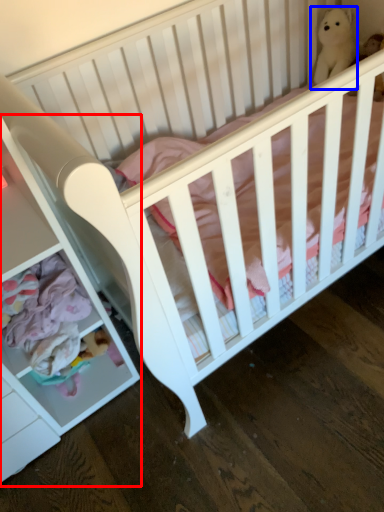
Question: Which object is further to the camera taking this photo, dresser (highlighted by a red box) or figurine (highlighted by a blue box)?

Choices:
 (A) dresser
 (B) figurine

Answer: (B)